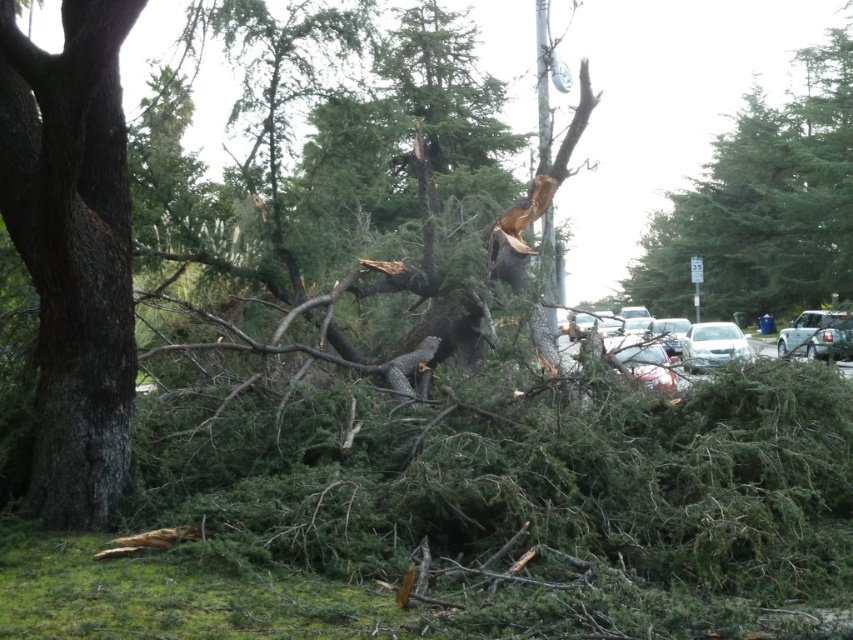
Question: Which object is the farthest from the green matte car at right?

Choices:
 (A) smooth brown tree trunk at left
 (B) green textured tree at upper right

Answer: (B)

Question: Does green textured tree at upper right have a smaller size compared to green matte car at right?

Choices:
 (A) yes
 (B) no

Answer: (B)

Question: Can you confirm if green textured tree at upper right is positioned to the left of green matte car at right?

Choices:
 (A) no
 (B) yes

Answer: (A)

Question: Can you confirm if smooth brown tree trunk at left is positioned to the right of green textured tree at upper right?

Choices:
 (A) yes
 (B) no

Answer: (B)

Question: Which point is closer to the camera?

Choices:
 (A) (654, 304)
 (B) (817, 356)
 (C) (62, 333)
 (D) (743, 355)

Answer: (C)

Question: Which is nearer to the green textured tree at upper right?

Choices:
 (A) green matte car at right
 (B) white matte car at center
 (C) smooth brown tree trunk at left

Answer: (A)